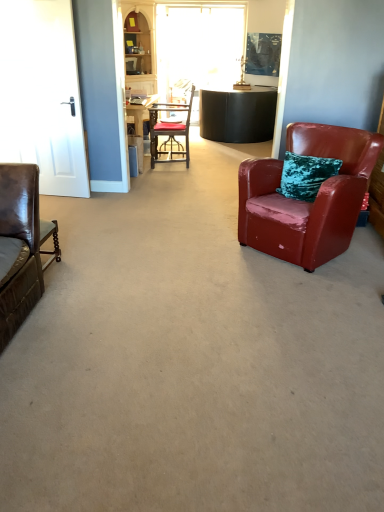
Measure the distance between shiny red leather armchair at right, arranged as the second chair when viewed from the back, and camera.

shiny red leather armchair at right, arranged as the second chair when viewed from the back, and camera are 8.48 feet apart.

Identify the location of shiny red leather armchair at right, marked as the second chair in a top-to-bottom arrangement. (306, 202).

What do you see at coordinates (140, 50) in the screenshot?
I see `wooden cabinet at upper left` at bounding box center [140, 50].

Describe the element at coordinates (170, 131) in the screenshot. I see `matte black chair at center, the 1th chair viewed from the top` at that location.

Where is `shiny red leather armchair at right, marked as the second chair in a top-to-bottom arrangement`? The height and width of the screenshot is (512, 384). shiny red leather armchair at right, marked as the second chair in a top-to-bottom arrangement is located at coordinates (306, 202).

From the image's perspective, which is below, shiny red leather armchair at right, marked as the second chair in a top-to-bottom arrangement, or transparent glass window at center?

shiny red leather armchair at right, marked as the second chair in a top-to-bottom arrangement, appears lower in the image.

Is point (296, 256) less distant than point (183, 40)?

That is True.

Can we say shiny red leather armchair at right, arranged as the second chair when viewed from the back, lies outside transparent glass window at center?

Absolutely, shiny red leather armchair at right, arranged as the second chair when viewed from the back, is external to transparent glass window at center.

Is wooden cabinet at upper left surrounding white glossy door at left?

No, wooden cabinet at upper left does not contain white glossy door at left.

Between point (140, 22) and point (71, 132), which one is positioned behind?

The point (140, 22) is farther from the camera.

From the image's perspective, between wooden cabinet at upper left and white glossy door at left, who is located below?

white glossy door at left appears lower in the image.

Does wooden cabinet at upper left come behind white glossy door at left?

Yes, the depth of wooden cabinet at upper left is greater than that of white glossy door at left.

Who is taller, wooden cabinet at upper left or shiny red leather armchair at right, which is the first chair in bottom-to-top order?

With more height is wooden cabinet at upper left.

Is point (146, 54) closer or farther from the camera than point (323, 245)?

Point (146, 54).

Where is `cabinetry above the shiny red leather armchair at right, marked as the second chair in a top-to-bottom arrangement (from a real-world perspective)`? This screenshot has width=384, height=512. cabinetry above the shiny red leather armchair at right, marked as the second chair in a top-to-bottom arrangement (from a real-world perspective) is located at coordinates (140, 50).

Based on the photo, from the image's perspective, is wooden cabinet at upper left below shiny red leather armchair at right, arranged as the 1th chair when viewed from the right?

Incorrect, from the image's perspective, wooden cabinet at upper left is higher than shiny red leather armchair at right, arranged as the 1th chair when viewed from the right.

Considering the relative sizes of matte black chair at center, positioned as the second chair in front-to-back order, and white glossy door at left in the image provided, is matte black chair at center, positioned as the second chair in front-to-back order, bigger than white glossy door at left?

Yes.

Choose the correct answer: Is matte black chair at center, the 1th chair viewed from the top, inside white glossy door at left or outside it?

The correct answer is: outside.

Is matte black chair at center, the first chair in the back-to-front sequence, positioned far away from white glossy door at left?

Yes, matte black chair at center, the first chair in the back-to-front sequence, and white glossy door at left are located far from each other.

This screenshot has height=512, width=384. I want to click on window positioned vertically above the white glossy door at left (from a real-world perspective), so click(x=198, y=45).

From the image's perspective, is transparent glass window at center under white glossy door at left?

Actually, transparent glass window at center appears above white glossy door at left in the image.

Is transparent glass window at center placed right next to white glossy door at left?

transparent glass window at center and white glossy door at left are not in contact.

Is transparent glass window at center to the right of white glossy door at left from the viewer's perspective?

Yes, transparent glass window at center is to the right of white glossy door at left.

Is shiny red leather armchair at right, placed as the 2th chair when sorted from left to right, oriented towards white glossy door at left?

No, shiny red leather armchair at right, placed as the 2th chair when sorted from left to right, is not turned towards white glossy door at left.

In terms of width, does shiny red leather armchair at right, the 1th chair from the front, look wider or thinner when compared to white glossy door at left?

shiny red leather armchair at right, the 1th chair from the front, is wider than white glossy door at left.

Could you measure the distance between shiny red leather armchair at right, which is the first chair in bottom-to-top order, and white glossy door at left?

A distance of 6.98 feet exists between shiny red leather armchair at right, which is the first chair in bottom-to-top order, and white glossy door at left.

Does point (284, 259) come closer to viewer compared to point (80, 134)?

Yes, it is.

Looking at this image, from the image's perspective, is transparent glass window at center beneath wooden cabinet at upper left?

Actually, transparent glass window at center appears above wooden cabinet at upper left in the image.

Is transparent glass window at center positioned with its back to wooden cabinet at upper left?

No, transparent glass window at center is not facing the opposite direction of wooden cabinet at upper left.

The image size is (384, 512). Find the location of `window located underneath the wooden cabinet at upper left (from a real-world perspective)`. window located underneath the wooden cabinet at upper left (from a real-world perspective) is located at coordinates pos(198,45).

Can you tell me how much transparent glass window at center and wooden cabinet at upper left differ in facing direction?

transparent glass window at center and wooden cabinet at upper left are facing 51.7 degrees away from each other.

What are the coordinates of `window that appears above the shiny red leather armchair at right, which is the first chair in bottom-to-top order (from the image's perspective)` in the screenshot? It's located at (198, 45).

Locate an element on the screen. glass door lying below the wooden cabinet at upper left (from the image's perspective) is located at coordinates (42, 94).

Looking at the image, which one is located further to wooden cabinet at upper left, shiny red leather armchair at right, marked as the second chair in a top-to-bottom arrangement, or transparent glass window at center?

Among the two, shiny red leather armchair at right, marked as the second chair in a top-to-bottom arrangement, is located further to wooden cabinet at upper left.

Based on the photo, based on their spatial positions, is white glossy door at left or matte black chair at center, which is the second chair from bottom to top, closer to transparent glass window at center?

Based on the image, matte black chair at center, which is the second chair from bottom to top, appears to be nearer to transparent glass window at center.

Based on their spatial positions, is white glossy door at left or shiny red leather armchair at right, the 1th chair from the front, closer to matte black chair at center, which is the first chair in left-to-right order?

The object closer to matte black chair at center, which is the first chair in left-to-right order, is white glossy door at left.

From the image, which object appears to be farther from matte black chair at center, positioned as the second chair in front-to-back order, white glossy door at left or transparent glass window at center?

white glossy door at left is positioned further to the anchor matte black chair at center, positioned as the second chair in front-to-back order.

From the image, which object appears to be farther from white glossy door at left, transparent glass window at center or shiny red leather armchair at right, placed as the 2th chair when sorted from left to right?

transparent glass window at center is positioned further to the anchor white glossy door at left.

Estimate the real-world distances between objects in this image. Which object is further from matte black chair at center, positioned as the second chair in front-to-back order, shiny red leather armchair at right, arranged as the second chair when viewed from the back, or transparent glass window at center?

shiny red leather armchair at right, arranged as the second chair when viewed from the back, lies further to matte black chair at center, positioned as the second chair in front-to-back order, than the other object.

Looking at the image, which one is located closer to transparent glass window at center, white glossy door at left or shiny red leather armchair at right, arranged as the 1th chair when viewed from the right?

Based on the image, white glossy door at left appears to be nearer to transparent glass window at center.

Which object lies further to the anchor point white glossy door at left, wooden cabinet at upper left or shiny red leather armchair at right, placed as the 2th chair when sorted from left to right?

wooden cabinet at upper left is further to white glossy door at left.

The width and height of the screenshot is (384, 512). Find the location of `cabinetry between matte black chair at center, which is the first chair in left-to-right order, and transparent glass window at center from front to back`. cabinetry between matte black chair at center, which is the first chair in left-to-right order, and transparent glass window at center from front to back is located at coordinates (140, 50).

Find the location of a particular element. This screenshot has width=384, height=512. chair between white glossy door at left and transparent glass window at center from front to back is located at coordinates (170, 131).

Find the location of a particular element. The width and height of the screenshot is (384, 512). chair between shiny red leather armchair at right, arranged as the 1th chair when viewed from the right, and wooden cabinet at upper left in the front-back direction is located at coordinates (170, 131).

I want to click on glass door between shiny red leather armchair at right, arranged as the 1th chair when viewed from the right, and matte black chair at center, which is the second chair from bottom to top, along the z-axis, so click(42, 94).